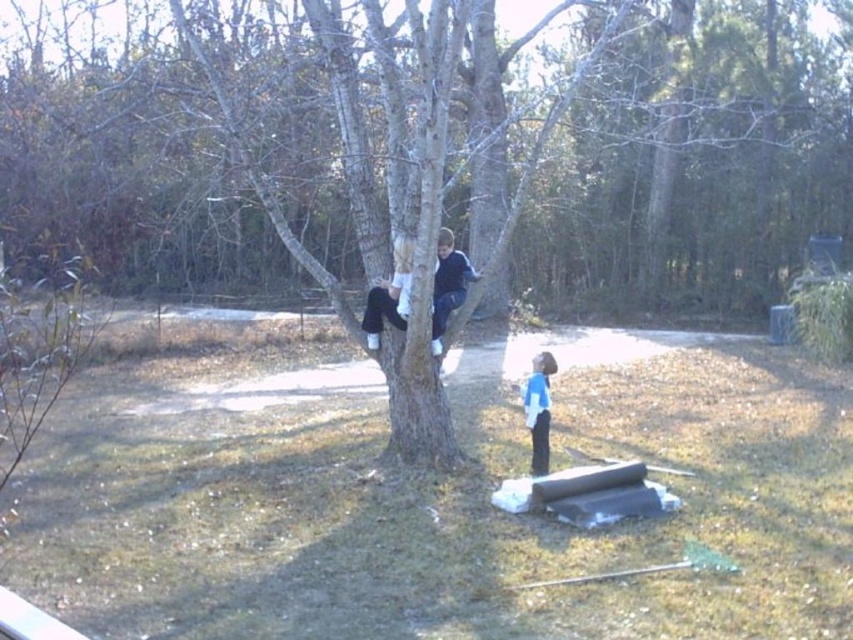
Which is behind, point (32, 200) or point (442, 301)?

Point (32, 200)

Which is more to the right, brown rough tree at center or blue fleece jacket at tree?

From the viewer's perspective, blue fleece jacket at tree appears more on the right side.

Is point (350, 172) behind point (471, 282)?

That is False.

Locate an element on the screen. This screenshot has width=853, height=640. brown rough tree at center is located at coordinates (209, 150).

Does brown grass at lower center have a larger size compared to brown rough tree at center?

No.

Between point (305, 472) and point (703, 224), which one is positioned in front?

Positioned in front is point (305, 472).

Is point (335, 586) in front of point (148, 144)?

Yes, point (335, 586) is in front of point (148, 144).

Where is `brown grass at lower center`? The image size is (853, 640). brown grass at lower center is located at coordinates (440, 500).

Does brown grass at lower center come in front of blue fleece jacket at tree?

Yes, brown grass at lower center is closer to the viewer.

Does brown grass at lower center appear on the right side of blue fleece jacket at tree?

Indeed, brown grass at lower center is positioned on the right side of blue fleece jacket at tree.

Image resolution: width=853 pixels, height=640 pixels. What are the coordinates of `brown grass at lower center` in the screenshot? It's located at (440, 500).